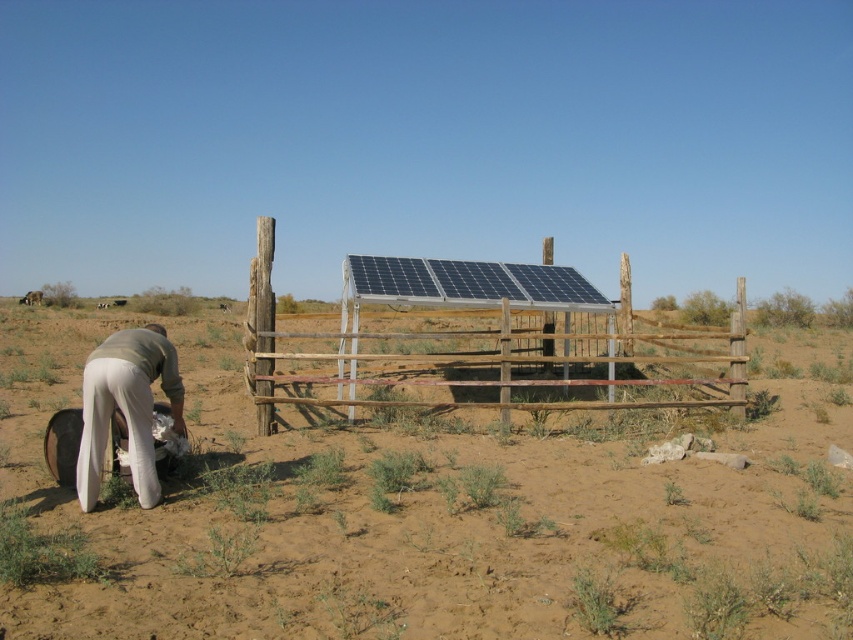
You are a farmer checking the boundaries of your property. You notice the brown sandy dirt field at center and the wooden fence at center. Which one has a lower height?

The brown sandy dirt field at center has a lesser height compared to the wooden fence at center, so the brown sandy dirt field at center is lower in height.

You are standing at the point marked by the coordinates [436,516] in the image. What do you see directly beneath your feet?

You are standing on the brown sandy dirt field at center located at point [436,516].

You are a maintenance worker who needs to place a new tool box on the ground near the wooden fence at center and the light beige fabric at lower left. Which object should you place the tool box closer to if you want it to be more visible from above? Explain your reasoning based on their heights.

The wooden fence at center is taller than the light beige fabric at lower left. Therefore, placing the tool box closer to the wooden fence at center would make it more visible from above since the fence provides a higher elevation point.